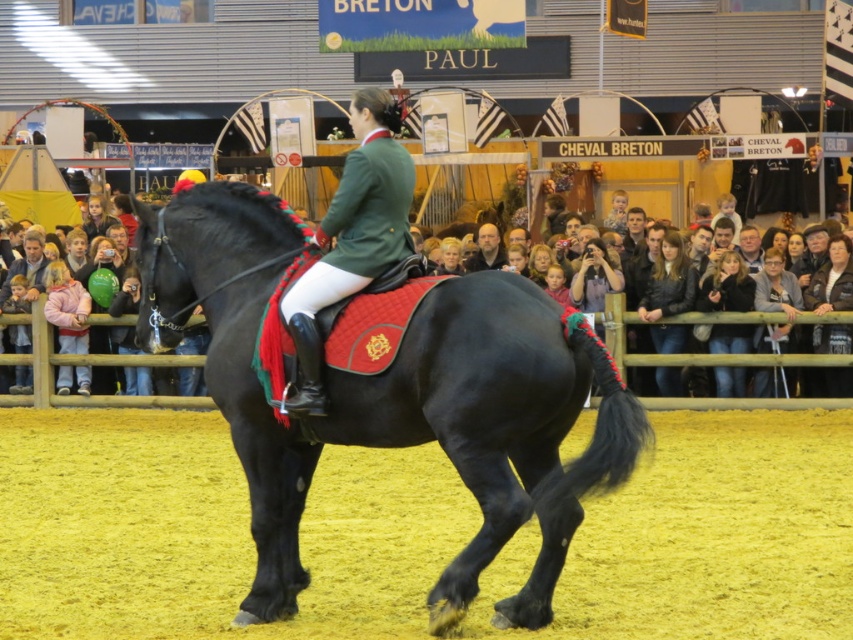
Question: Which object appears farthest from the camera in this image?

Choices:
 (A) shiny black horse at center
 (B) green matte jacket at center

Answer: (B)

Question: Does shiny black horse at center appear on the right side of black leather jacket at center?

Choices:
 (A) no
 (B) yes

Answer: (A)

Question: Considering the real-world distances, which object is farthest from the gray fabric jacket at center?

Choices:
 (A) black leather jacket at center
 (B) dark blue denim jacket at center
 (C) smooth wooden fence at lower center
 (D) dark brown leather jacket at center

Answer: (D)

Question: Which point is farther to the camera?

Choices:
 (A) (757, 376)
 (B) (663, 275)
 (C) (381, 157)
 (D) (82, 404)

Answer: (D)

Question: Is the position of black leather jacket at center more distant than that of gray fabric jacket at center?

Choices:
 (A) no
 (B) yes

Answer: (B)

Question: Can you confirm if green matte jacket at center is positioned above gray fabric jacket at center?

Choices:
 (A) yes
 (B) no

Answer: (A)